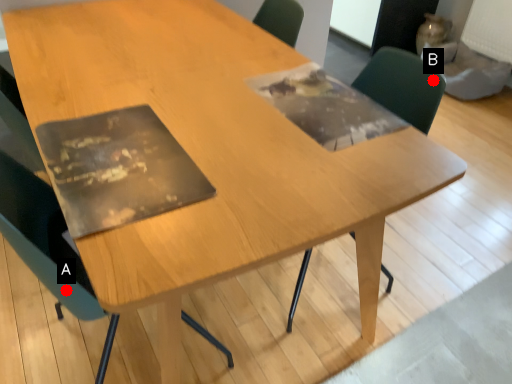
Question: Two points are circled on the image, labeled by A and B beside each circle. Among these points, which one is nearest to the camera?

Choices:
 (A) A is closer
 (B) B is closer

Answer: (A)